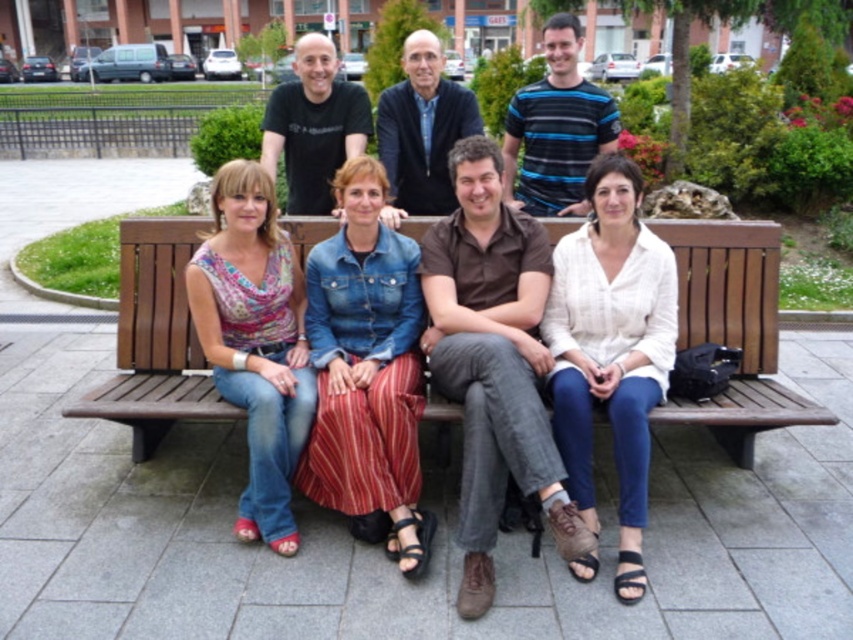
Based on the scene description, where is the brown cotton shirt at center positioned relative to the other people on the bench?

The brown cotton shirt at center is located at point [492,362], which places it centrally on the bench among the six people.

Based on the scene description, if you were to place the printed cotton blouse at left on the wooden bench at center, would it fit comfortably without overlapping the edges?

The wooden bench at center is larger in size than the printed cotton blouse at left, so it would fit comfortably without overlapping the edges.